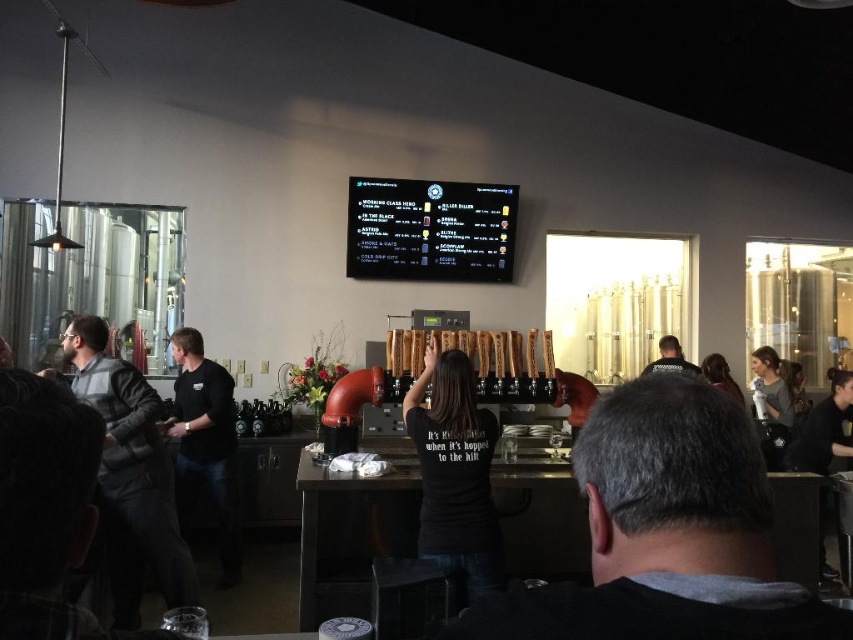
You are a bartender at the bar counter. You need to hand a drink to both the person wearing the black matte shirt at left and the one in the black leather jacket at center. Who should you serve first if you want to reach them without moving from your current position?

The black matte shirt at left is in front of the black leather jacket at center, so you should serve the person in the black matte shirt at left first since they are closer to you.